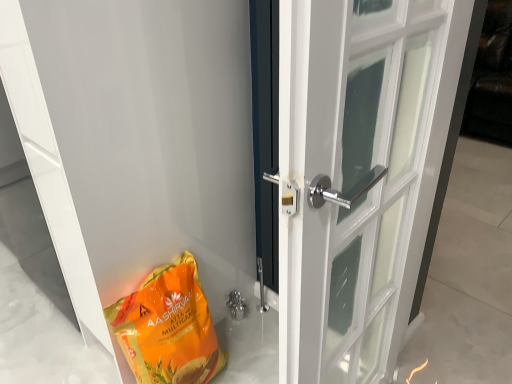
Where is `polished chrome door handle at center, which is the first door in right-to-left order`? The height and width of the screenshot is (384, 512). polished chrome door handle at center, which is the first door in right-to-left order is located at coordinates pos(358,174).

Identify the location of polished chrome door handle at center, which is the first door in right-to-left order. This screenshot has height=384, width=512. (358, 174).

Is point (302, 327) farther from viewer compared to point (207, 353)?

No, (302, 327) is in front of (207, 353).

What are the coordinates of `door located on the right of orange matte/glossy grocery bag at lower left` in the screenshot? It's located at (358, 174).

Would you say polished chrome door handle at center, which is the first door in right-to-left order, contains orange matte/glossy grocery bag at lower left?

No, orange matte/glossy grocery bag at lower left is not a part of polished chrome door handle at center, which is the first door in right-to-left order.

From the image's perspective, would you say orange matte/glossy grocery bag at lower left is positioned over polished chrome door handle at center, which is the first door in right-to-left order?

Incorrect, from the image's perspective, orange matte/glossy grocery bag at lower left is lower than polished chrome door handle at center, which is the first door in right-to-left order.

Is orange matte/glossy grocery bag at lower left not close to polished chrome door handle at center, which is the first door in right-to-left order?

Actually, orange matte/glossy grocery bag at lower left and polished chrome door handle at center, which is the first door in right-to-left order, are a little close together.

How much distance is there between orange matte/glossy grocery bag at lower left and polished chrome door handle at center, which is the first door in right-to-left order?

orange matte/glossy grocery bag at lower left is 24.98 inches away from polished chrome door handle at center, which is the first door in right-to-left order.

Considering the positions of objects orange matte/glossy grocery bag at lower left and polished chrome door handle at center, which is the first door in right-to-left order, in the image provided, who is in front, orange matte/glossy grocery bag at lower left or polished chrome door handle at center, which is the first door in right-to-left order,?

orange matte/glossy grocery bag at lower left is closer to the camera.

From the image's perspective, between polished chrome door handle at center, which is the first door in right-to-left order, and white glossy door at lower left, positioned as the first door in left-to-right order, which one is located above?

From the image's view, white glossy door at lower left, positioned as the first door in left-to-right order, is above.

How many degrees apart are the facing directions of polished chrome door handle at center, marked as the second door in a left-to-right arrangement, and white glossy door at lower left, positioned as the first door in left-to-right order?

0.21 degrees.

From a real-world perspective, is polished chrome door handle at center, which is the first door in right-to-left order, on white glossy door at lower left, positioned as the second door in right-to-left order?

No.

The image size is (512, 384). In order to click on door above the polished chrome door handle at center, marked as the second door in a left-to-right arrangement (from a real-world perspective) in this screenshot , I will do `click(142, 153)`.

Does white glossy door at lower left, positioned as the second door in right-to-left order, turn towards orange matte/glossy grocery bag at lower left?

No.

Is white glossy door at lower left, positioned as the second door in right-to-left order, further to camera compared to orange matte/glossy grocery bag at lower left?

No, the depth of white glossy door at lower left, positioned as the second door in right-to-left order, is less than that of orange matte/glossy grocery bag at lower left.

Does white glossy door at lower left, positioned as the second door in right-to-left order, have a lesser height compared to orange matte/glossy grocery bag at lower left?

Incorrect, the height of white glossy door at lower left, positioned as the second door in right-to-left order, does not fall short of that of orange matte/glossy grocery bag at lower left.

From a real-world perspective, is white glossy door at lower left, positioned as the second door in right-to-left order, physically above orange matte/glossy grocery bag at lower left?

Yes, from a real-world perspective, white glossy door at lower left, positioned as the second door in right-to-left order, is over orange matte/glossy grocery bag at lower left

Is white glossy door at lower left, positioned as the first door in left-to-right order, facing away from polished chrome door handle at center, marked as the second door in a left-to-right arrangement?

Absolutely, white glossy door at lower left, positioned as the first door in left-to-right order, is directed away from polished chrome door handle at center, marked as the second door in a left-to-right arrangement.

Does white glossy door at lower left, positioned as the first door in left-to-right order, have a lesser width compared to polished chrome door handle at center, marked as the second door in a left-to-right arrangement?

Correct, the width of white glossy door at lower left, positioned as the first door in left-to-right order, is less than that of polished chrome door handle at center, marked as the second door in a left-to-right arrangement.

Is white glossy door at lower left, positioned as the first door in left-to-right order, inside or outside of polished chrome door handle at center, marked as the second door in a left-to-right arrangement?

white glossy door at lower left, positioned as the first door in left-to-right order, cannot be found inside polished chrome door handle at center, marked as the second door in a left-to-right arrangement.

From a real-world perspective, is white glossy door at lower left, positioned as the second door in right-to-left order, located beneath polished chrome door handle at center, which is the first door in right-to-left order?

No, from a real-world perspective, white glossy door at lower left, positioned as the second door in right-to-left order, is not under polished chrome door handle at center, which is the first door in right-to-left order.

I want to click on door in front of the orange matte/glossy grocery bag at lower left, so [x=142, y=153].

Is orange matte/glossy grocery bag at lower left located outside white glossy door at lower left, positioned as the second door in right-to-left order?

That's correct, orange matte/glossy grocery bag at lower left is outside of white glossy door at lower left, positioned as the second door in right-to-left order.

Between point (181, 331) and point (37, 172), which one is positioned in front?

The point (37, 172) is more forward.

Is orange matte/glossy grocery bag at lower left next to white glossy door at lower left, positioned as the first door in left-to-right order?

There is a gap between orange matte/glossy grocery bag at lower left and white glossy door at lower left, positioned as the first door in left-to-right order.

Find the location of a particular element. This screenshot has height=384, width=512. grocery bag located above the polished chrome door handle at center, which is the first door in right-to-left order (from a real-world perspective) is located at coordinates (168, 327).

What are the coordinates of `door that appears below the orange matte/glossy grocery bag at lower left (from a real-world perspective)` in the screenshot? It's located at (358, 174).

Based on their spatial positions, is orange matte/glossy grocery bag at lower left or white glossy door at lower left, positioned as the first door in left-to-right order, further from polished chrome door handle at center, marked as the second door in a left-to-right arrangement?

Among the two, orange matte/glossy grocery bag at lower left is located further to polished chrome door handle at center, marked as the second door in a left-to-right arrangement.

Looking at the image, which one is located further to orange matte/glossy grocery bag at lower left, white glossy door at lower left, positioned as the second door in right-to-left order, or polished chrome door handle at center, marked as the second door in a left-to-right arrangement?

polished chrome door handle at center, marked as the second door in a left-to-right arrangement, is further to orange matte/glossy grocery bag at lower left.

Estimate the real-world distances between objects in this image. Which object is closer to white glossy door at lower left, positioned as the second door in right-to-left order, orange matte/glossy grocery bag at lower left or polished chrome door handle at center, which is the first door in right-to-left order?

orange matte/glossy grocery bag at lower left is closer to white glossy door at lower left, positioned as the second door in right-to-left order.

Which object lies nearer to the anchor point white glossy door at lower left, positioned as the second door in right-to-left order, polished chrome door handle at center, marked as the second door in a left-to-right arrangement, or orange matte/glossy grocery bag at lower left?

Among the two, orange matte/glossy grocery bag at lower left is located nearer to white glossy door at lower left, positioned as the second door in right-to-left order.

From the picture: Which object lies further to the anchor point polished chrome door handle at center, marked as the second door in a left-to-right arrangement, white glossy door at lower left, positioned as the first door in left-to-right order, or orange matte/glossy grocery bag at lower left?

Among the two, orange matte/glossy grocery bag at lower left is located further to polished chrome door handle at center, marked as the second door in a left-to-right arrangement.

Based on their spatial positions, is polished chrome door handle at center, which is the first door in right-to-left order, or white glossy door at lower left, positioned as the first door in left-to-right order, closer to orange matte/glossy grocery bag at lower left?

Based on the image, white glossy door at lower left, positioned as the first door in left-to-right order, appears to be nearer to orange matte/glossy grocery bag at lower left.

Find the location of a particular element. The width and height of the screenshot is (512, 384). grocery bag located between white glossy door at lower left, positioned as the second door in right-to-left order, and polished chrome door handle at center, marked as the second door in a left-to-right arrangement, in the left-right direction is located at coordinates (168, 327).